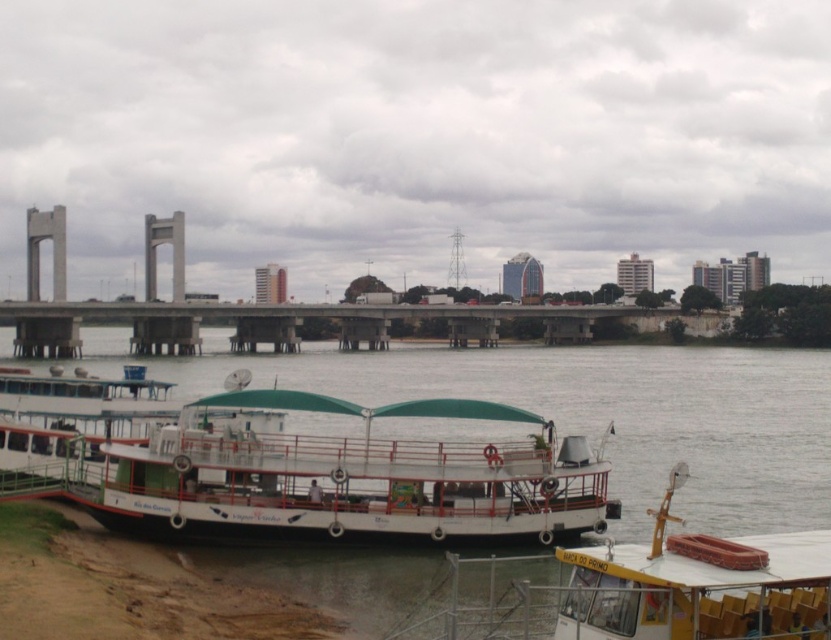
Can you confirm if white matte river at center is positioned below yellow plastic chairs at lower right?

Yes, white matte river at center is below yellow plastic chairs at lower right.

Is white matte river at center shorter than yellow plastic chairs at lower right?

No, white matte river at center is not shorter than yellow plastic chairs at lower right.

Where is `white matte river at center`? The image size is (831, 640). white matte river at center is located at coordinates (623, 413).

I want to click on white matte river at center, so click(x=623, y=413).

The width and height of the screenshot is (831, 640). Describe the element at coordinates (623, 413) in the screenshot. I see `white matte river at center` at that location.

Locate an element on the screen. white matte river at center is located at coordinates (623, 413).

I want to click on white matte river at center, so click(x=623, y=413).

Is point (667, 572) less distant than point (296, 326)?

That is True.

Between point (665, 628) and point (471, 314), which one is positioned in front?

Point (665, 628)

At what (x,y) coordinates should I click in order to perform the action: click on yellow plastic chairs at lower right. Please return your answer as a coordinate pair (x, y). The width and height of the screenshot is (831, 640). Looking at the image, I should click on [x=697, y=584].